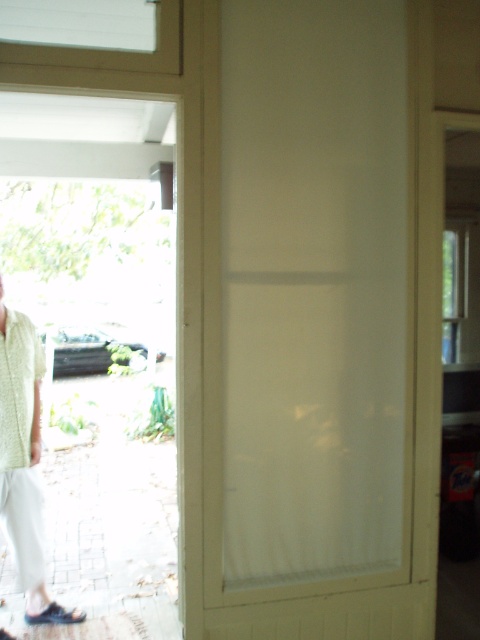
You are standing inside the house and want to know where the light green woven shirt at left is located in the image. Can you describe its position using coordinates?

The light green woven shirt at left is located at coordinates (24, 460).

From the picture: You are moving a 4 feet wide sofa through the partially open door. The white translucent screen door at center and the white knitted shirt at left are in your path. Can you fit the sofa through the space between them?

The distance between the white translucent screen door at center and the white knitted shirt at left is 3.94 feet. Since the sofa is 4 feet wide, it cannot fit through the space as the available width is slightly less than the sofa.

You are trying to enter the house through the door. The screen door is at the center. Where should you aim to push the white translucent screen door at center to open it further?

Since the white translucent screen door at center is positioned at coordinates approximately 0.498 on the x and 0.644 on the y axis, you should aim to push near the center of the door to open it further.